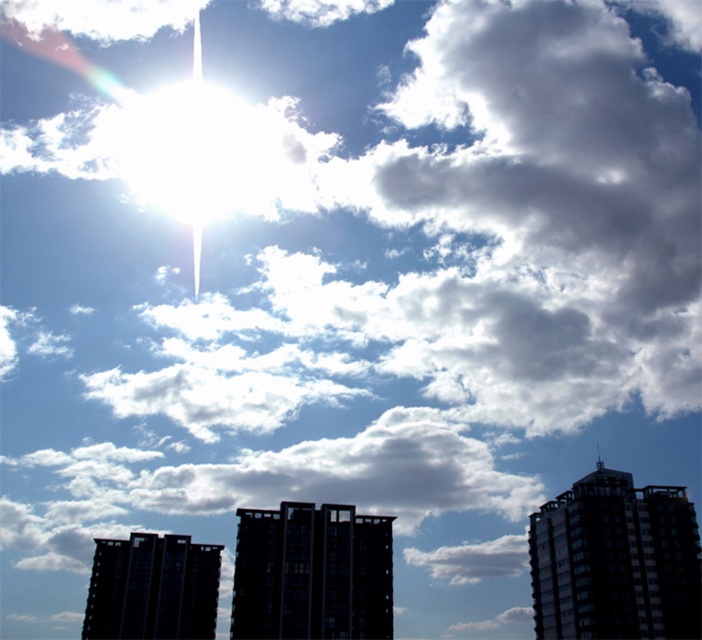
Question: Does black glass building at center appear on the right side of dark glass building at lower left?

Choices:
 (A) yes
 (B) no

Answer: (A)

Question: Which object is the closest to the black glass building at center?

Choices:
 (A) glassy reflective skyscraper at right
 (B) dark glass building at lower left

Answer: (B)

Question: Which point appears closest to the camera in this image?

Choices:
 (A) (150, 550)
 (B) (289, 564)

Answer: (B)

Question: Does black glass building at center have a smaller size compared to dark glass building at lower left?

Choices:
 (A) yes
 (B) no

Answer: (A)

Question: Which of the following is the farthest from the observer?

Choices:
 (A) black glass building at center
 (B) glassy reflective skyscraper at right
 (C) dark glass building at lower left

Answer: (C)

Question: Does glassy reflective skyscraper at right have a lesser width compared to dark glass building at lower left?

Choices:
 (A) no
 (B) yes

Answer: (A)